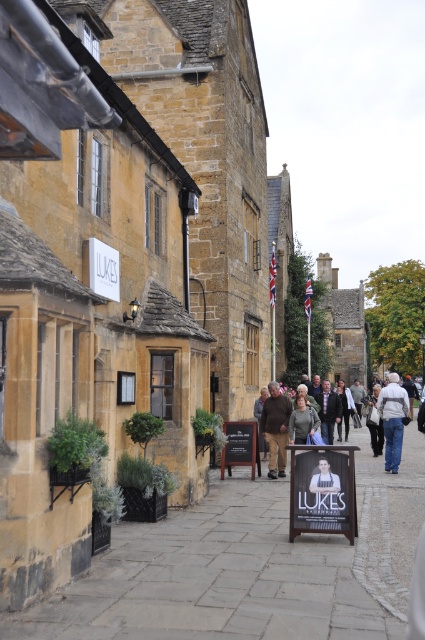
Does point (271, 435) lie in front of point (404, 413)?

Yes, point (271, 435) is closer to viewer.

Can you confirm if brown leather jacket at center is wider than light gray fabric jacket at center?

No, brown leather jacket at center is not wider than light gray fabric jacket at center.

Measure the distance between brown leather jacket at center and camera.

They are 18.80 meters apart.

Locate an element on the screen. The width and height of the screenshot is (425, 640). brown leather jacket at center is located at coordinates (275, 428).

The height and width of the screenshot is (640, 425). Find the location of `paved stone at center`. paved stone at center is located at coordinates (249, 566).

Does paved stone at center have a larger size compared to brown leather jacket at center?

Correct, paved stone at center is larger in size than brown leather jacket at center.

Is point (102, 563) closer to camera compared to point (266, 417)?

Yes, point (102, 563) is closer to viewer.

Identify the location of paved stone at center. Image resolution: width=425 pixels, height=640 pixels. click(249, 566).

Who is taller, brown leather jacket at center or dark gray sweater at center?

brown leather jacket at center

Which is in front, point (277, 387) or point (336, 404)?

Point (277, 387) is more forward.

Find the location of a particular element. The height and width of the screenshot is (640, 425). brown leather jacket at center is located at coordinates coord(275,428).